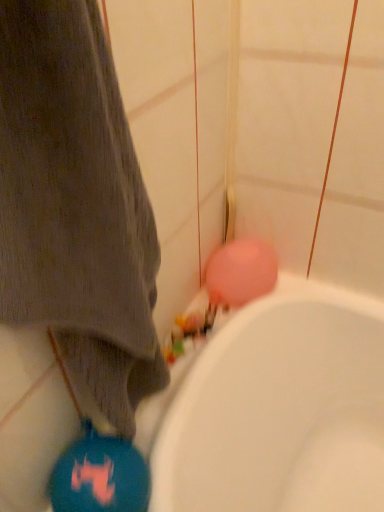
The height and width of the screenshot is (512, 384). Describe the element at coordinates (100, 475) in the screenshot. I see `blue rubber toy at lower left` at that location.

Measure the distance between point (82, 459) and camera.

The distance of point (82, 459) from camera is 23.15 inches.

Locate an element on the screen. This screenshot has height=512, width=384. blue rubber toy at lower left is located at coordinates [x=100, y=475].

Identify the location of blue rubber toy at lower left. (x=100, y=475).